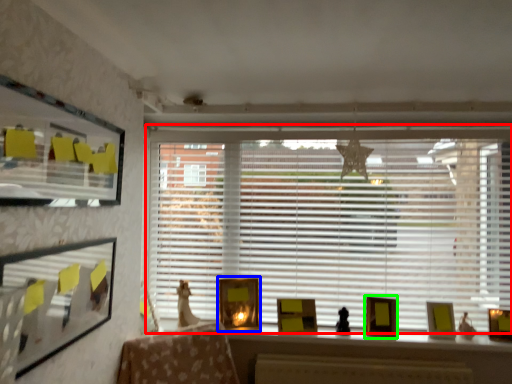
Question: Which object is the closest to the window blind (highlighted by a red box)? Choose among these: picture frame (highlighted by a blue box) or picture frame (highlighted by a green box).

Choices:
 (A) picture frame
 (B) picture frame

Answer: (A)